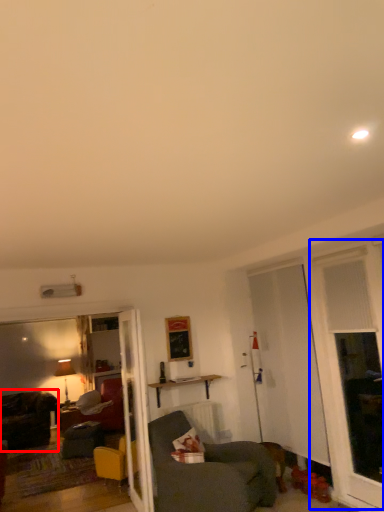
Question: Which of the following is the farthest to the observer, chair (highlighted by a red box) or window (highlighted by a blue box)?

Choices:
 (A) chair
 (B) window

Answer: (A)